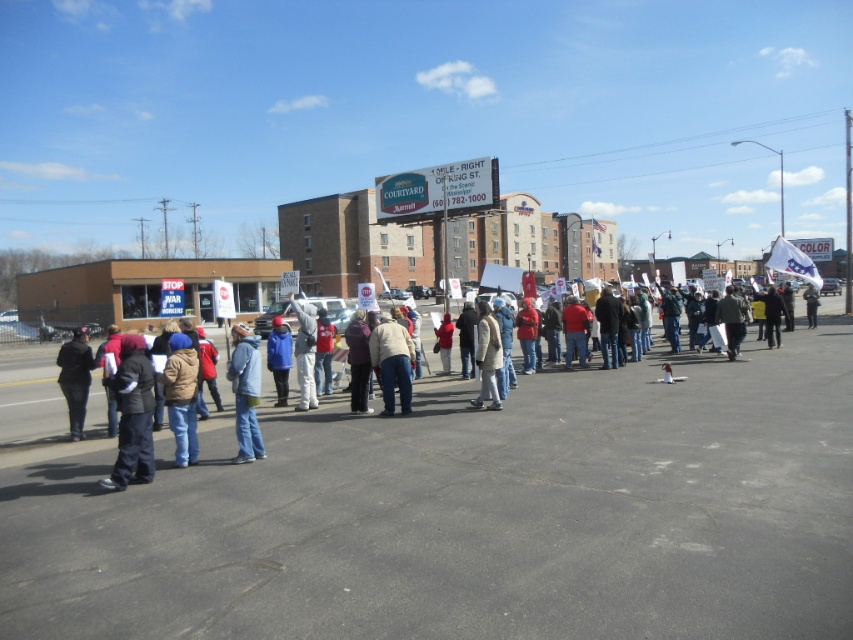
Question: Is the position of gray asphalt parking lot at center more distant than that of light gray jacket at center?

Choices:
 (A) yes
 (B) no

Answer: (B)

Question: Which object is closer to the camera taking this photo?

Choices:
 (A) white matte jacket at center
 (B) black leather jacket at left
 (C) blue denim jeans at lower left

Answer: (C)

Question: Which object is positioned closest to the dark blue jeans at left?

Choices:
 (A) blue fleece jacket at center
 (B) light beige sweater at center
 (C) gray asphalt parking lot at center

Answer: (B)

Question: Is brown fuzzy jacket at lower left to the left of blue fleece jacket at center from the viewer's perspective?

Choices:
 (A) no
 (B) yes

Answer: (A)

Question: Which object appears closest to the camera in this image?

Choices:
 (A) dark blue jeans at left
 (B) brown fuzzy jacket at lower left

Answer: (A)

Question: Can you confirm if white matte jacket at center is wider than blue fleece jacket at center?

Choices:
 (A) no
 (B) yes

Answer: (A)